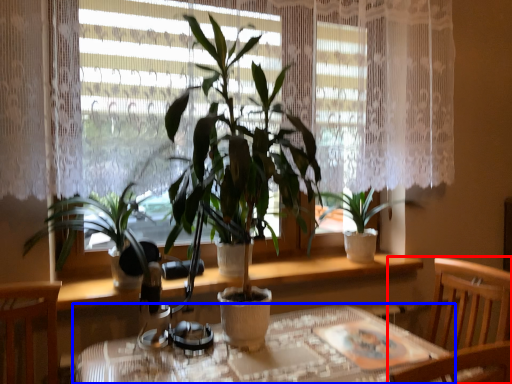
Question: Which object appears farthest to the camera in this image, chair (highlighted by a red box) or table (highlighted by a blue box)?

Choices:
 (A) chair
 (B) table

Answer: (A)